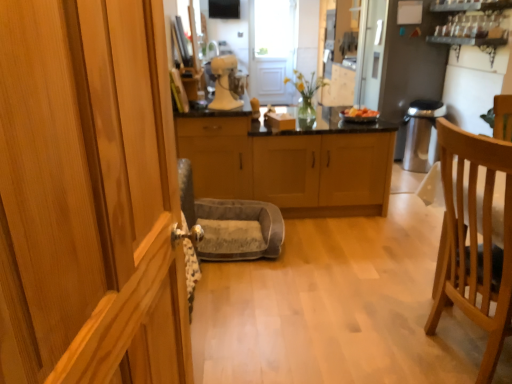
Identify the location of vacant area that lies in front of light wood cabinetry at center, the 3th cabinetry in the left-to-right sequence. Image resolution: width=512 pixels, height=384 pixels. (342, 252).